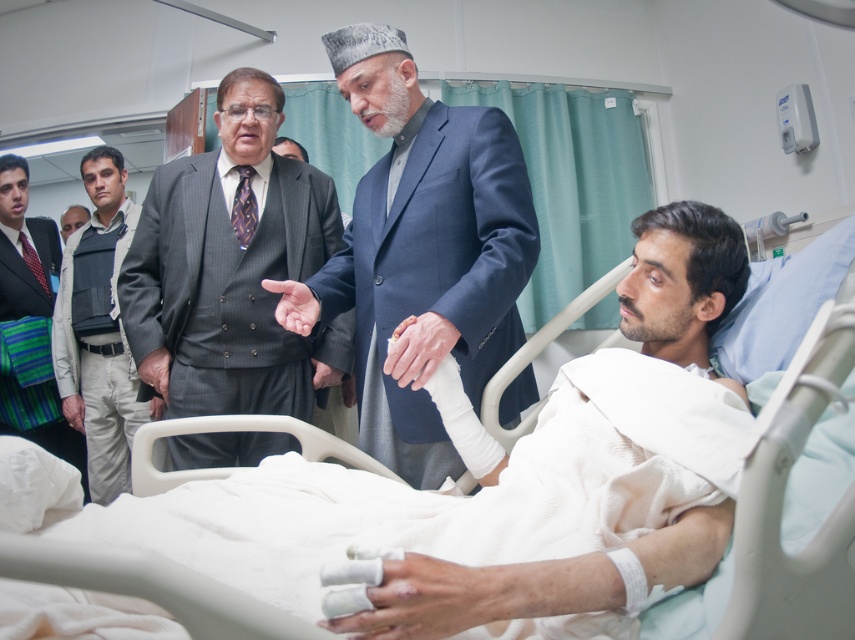
Question: Estimate the real-world distances between objects in this image. Which object is farther from the white bandaged arm at center?

Choices:
 (A) dark gray fabric vest at center-left
 (B) blue woolen suit at center
 (C) gray pinstripe suit at center

Answer: (A)

Question: Is white bandaged arm at center thinner than dark gray suit at center?

Choices:
 (A) yes
 (B) no

Answer: (A)

Question: Is blue woolen suit at center smaller than white plastic hospital bed at center?

Choices:
 (A) yes
 (B) no

Answer: (A)

Question: Is gray pinstripe suit at center smaller than dark gray suit at center?

Choices:
 (A) no
 (B) yes

Answer: (A)

Question: Which point is closer to the camera?

Choices:
 (A) dark gray suit at center
 (B) white plastic hospital bed at center
 (C) white bandaged arm at center
 (D) blue woolen suit at center

Answer: (B)

Question: Which point is closer to the camera?

Choices:
 (A) striped fabric vest at center-left
 (B) dark gray fabric vest at center-left
 (C) white plastic hospital bed at center
 (D) dark gray suit at center

Answer: (C)